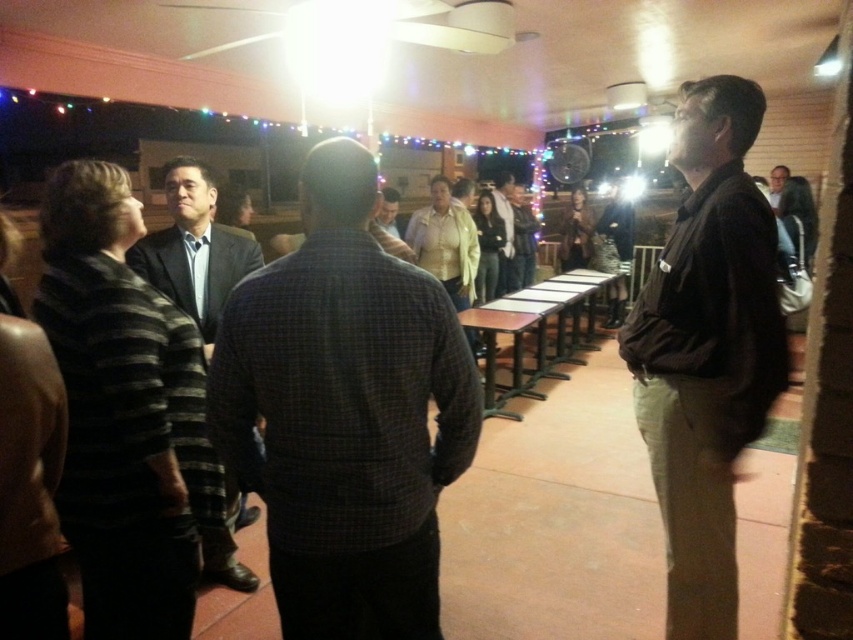
Is light brown leather jacket at center wider than matte yellow shirt at center?

Indeed, light brown leather jacket at center has a greater width compared to matte yellow shirt at center.

Who is positioned more to the right, light brown leather jacket at center or matte yellow shirt at center?

light brown leather jacket at center is more to the right.

You are a GUI agent. You are given a task and a screenshot of the screen. Output one action in this format:
    pyautogui.click(x=<x>, y=<y>)
    Task: Click on the light brown leather jacket at center
    
    Given the screenshot: What is the action you would take?
    pyautogui.click(x=505, y=230)

Find the location of a particular element. The width and height of the screenshot is (853, 640). light brown leather jacket at center is located at coordinates (505, 230).

Between plaid shirt at center and brown shirt at right, which one is positioned lower?

plaid shirt at center is lower down.

Does plaid shirt at center lie behind brown shirt at right?

That is False.

Image resolution: width=853 pixels, height=640 pixels. What do you see at coordinates (345, 413) in the screenshot?
I see `plaid shirt at center` at bounding box center [345, 413].

At what (x,y) coordinates should I click in order to perform the action: click on plaid shirt at center. Please return your answer as a coordinate pair (x, y). Looking at the image, I should click on (345, 413).

Does brown shirt at right have a larger size compared to light brown leather jacket at center?

Indeed, brown shirt at right has a larger size compared to light brown leather jacket at center.

Does point (772, 186) come behind point (509, 173)?

No.

You are a GUI agent. You are given a task and a screenshot of the screen. Output one action in this format:
    pyautogui.click(x=<x>, y=<y>)
    Task: Click on the brown shirt at right
    
    Given the screenshot: What is the action you would take?
    pyautogui.click(x=795, y=211)